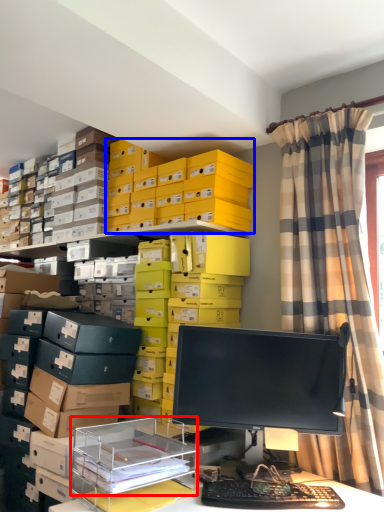
Question: Which object is closer to the camera taking this photo, shelf (highlighted by a red box) or storage box (highlighted by a blue box)?

Choices:
 (A) shelf
 (B) storage box

Answer: (A)